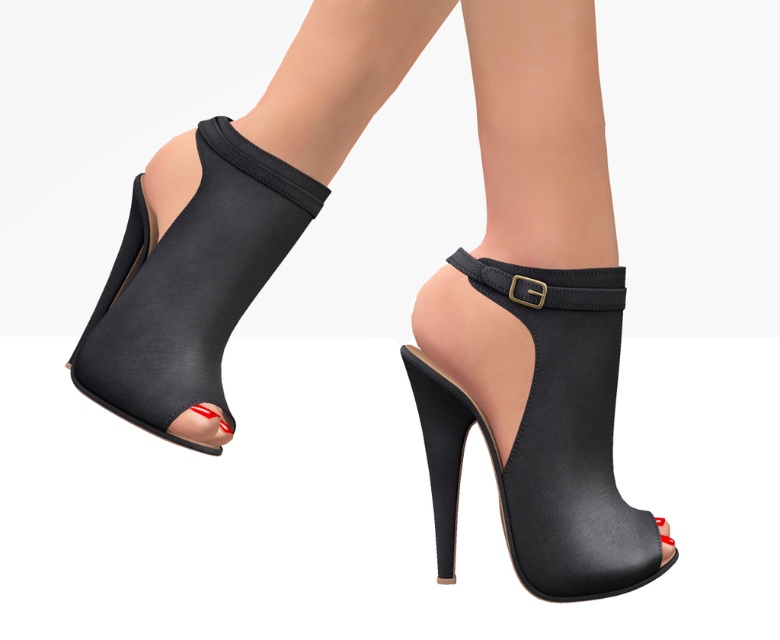
Between point (429, 442) and point (139, 369), which one is positioned in front?

Point (139, 369)

This screenshot has height=640, width=780. I want to click on satin black peep-toe sandal at center, so click(546, 436).

Looking at this image, who is higher up, satin black high-heeled shoe at center or black leather strap at center?

black leather strap at center is above.

Is point (463, 403) positioned before point (507, 282)?

No, it is not.

Find the location of a particular element. satin black high-heeled shoe at center is located at coordinates (236, 216).

Where is `satin black peep-toe sandal at center`? satin black peep-toe sandal at center is located at coordinates (546, 436).

From the picture: Which is more to the left, satin black peep-toe sandal at center or black leather strap at center?

From the viewer's perspective, satin black peep-toe sandal at center appears more on the left side.

The height and width of the screenshot is (640, 780). In order to click on satin black peep-toe sandal at center in this screenshot , I will do `click(546, 436)`.